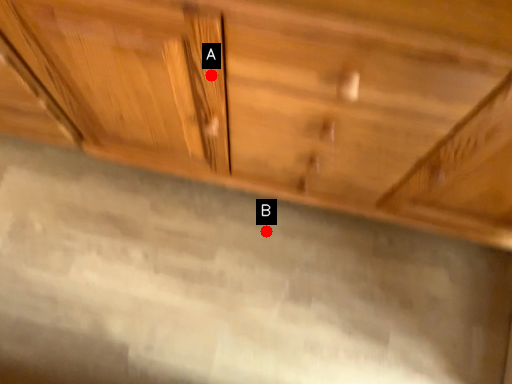
Question: Two points are circled on the image, labeled by A and B beside each circle. Which point is closer to the camera?

Choices:
 (A) A is closer
 (B) B is closer

Answer: (A)